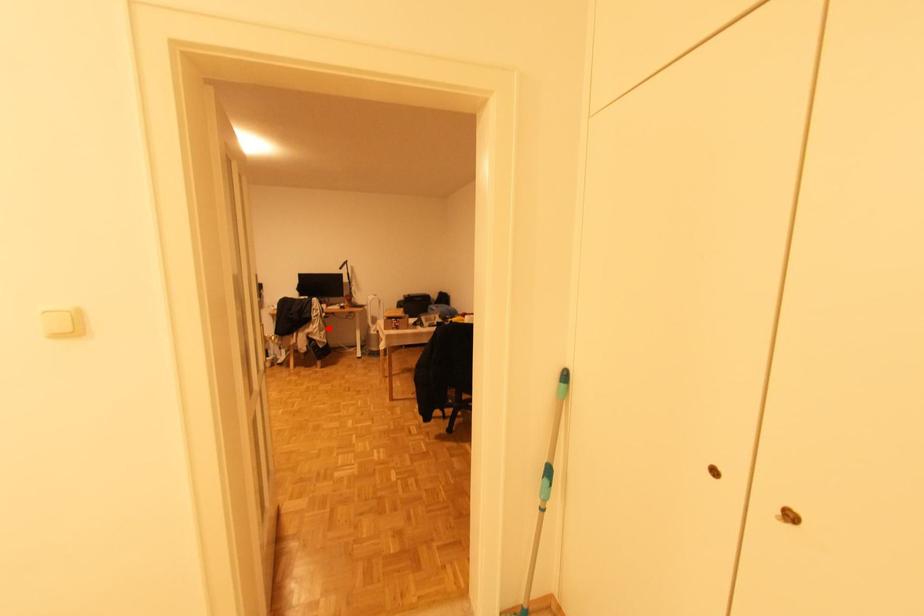
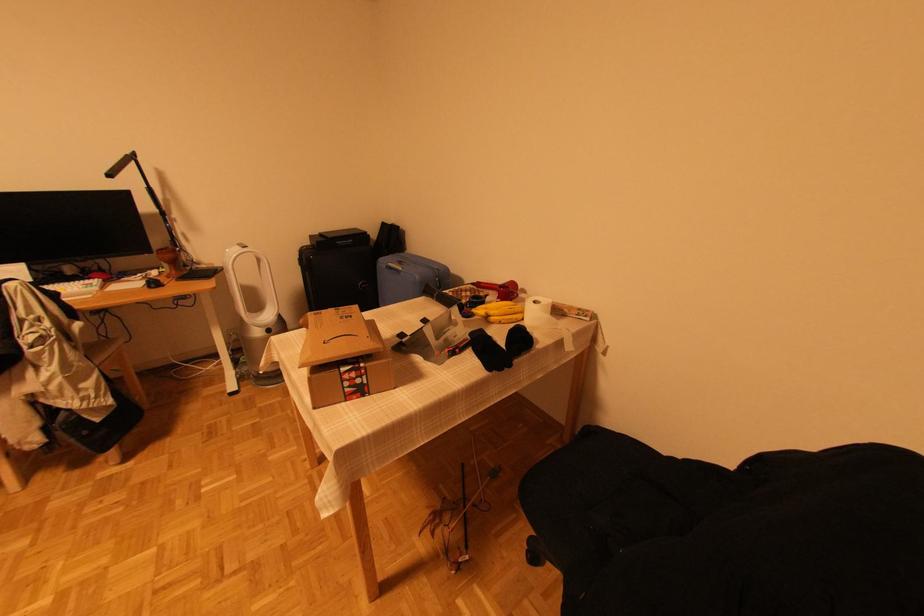
Locate, in the second image, the point that corresponds to the highlighted location in the first image.

(114, 351)